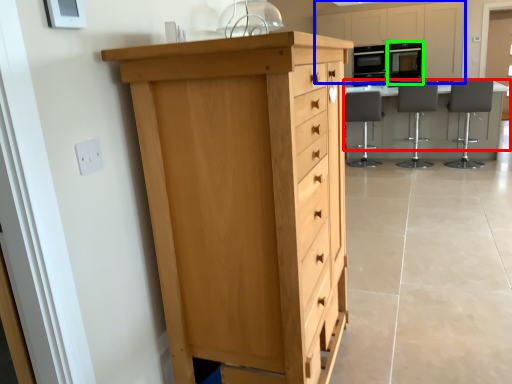
Question: Considering the real-world distances, which object is farthest from table (highlighted by a red box)? cabinetry (highlighted by a blue box) or appliance (highlighted by a green box)?

Choices:
 (A) cabinetry
 (B) appliance

Answer: (A)